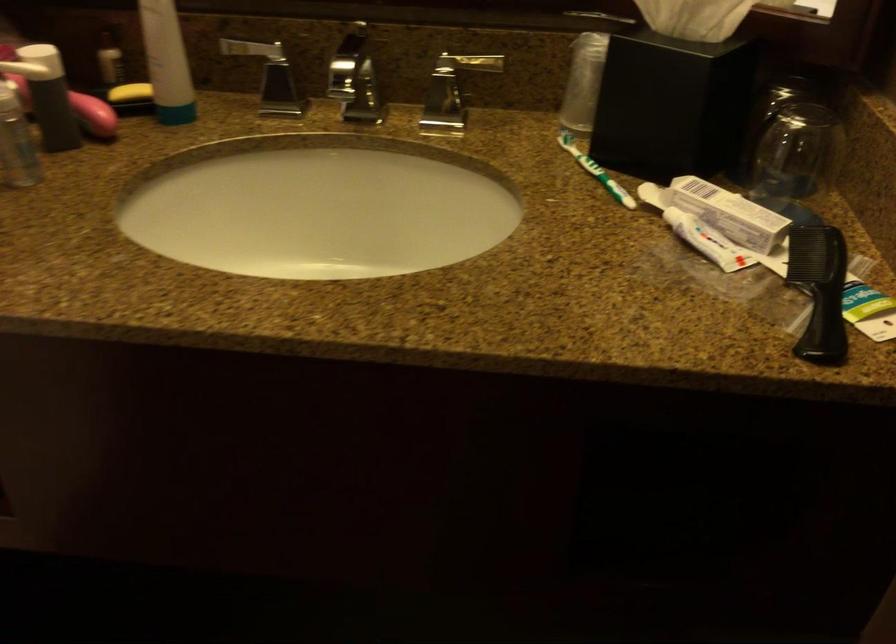
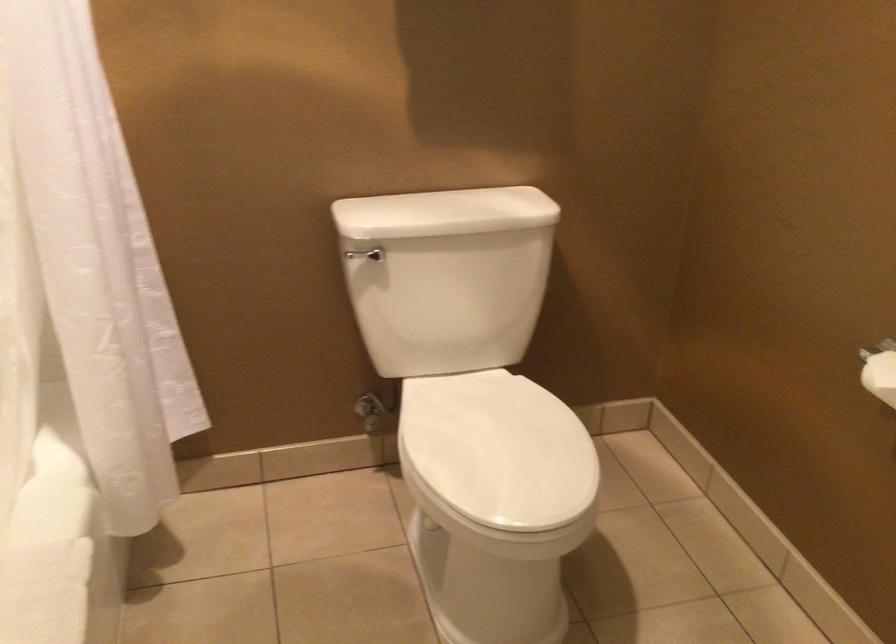
Question: The camera is either moving clockwise (left) or counter-clockwise (right) around the object. The first image is from the beginning of the video and the second image is from the end. Is the camera moving left or right when shooting the video?

Choices:
 (A) Left
 (B) Right

Answer: (B)